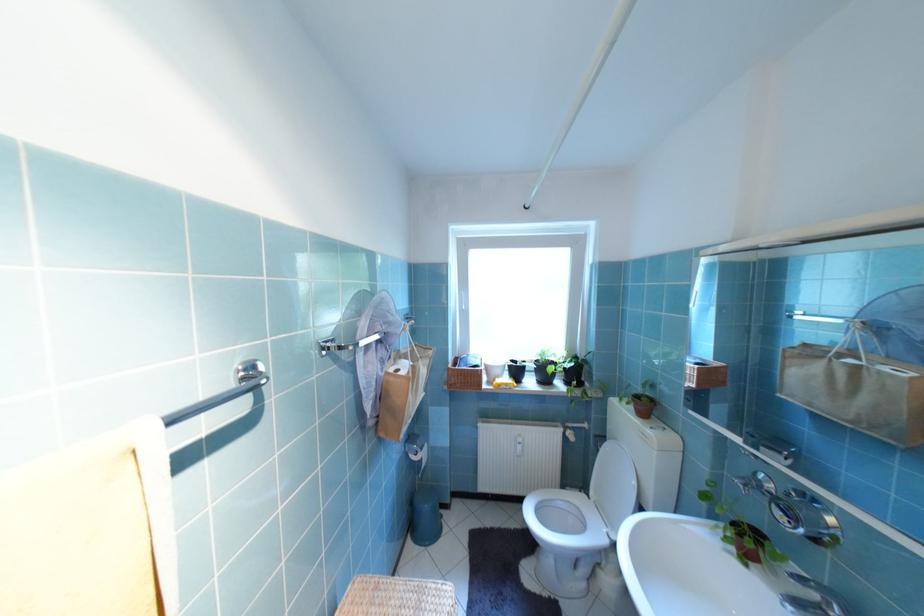
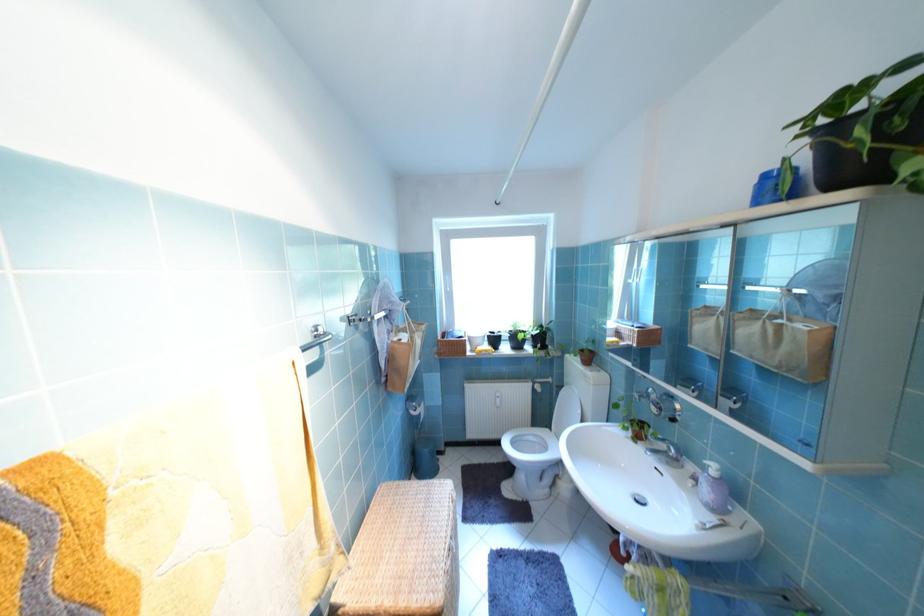
Question: Which direction would the cameraman need to move to produce the second image? Reply with the corresponding letter.

Choices:
 (A) Left
 (B) Right
 (C) Forward
 (D) Backward

Answer: (D)